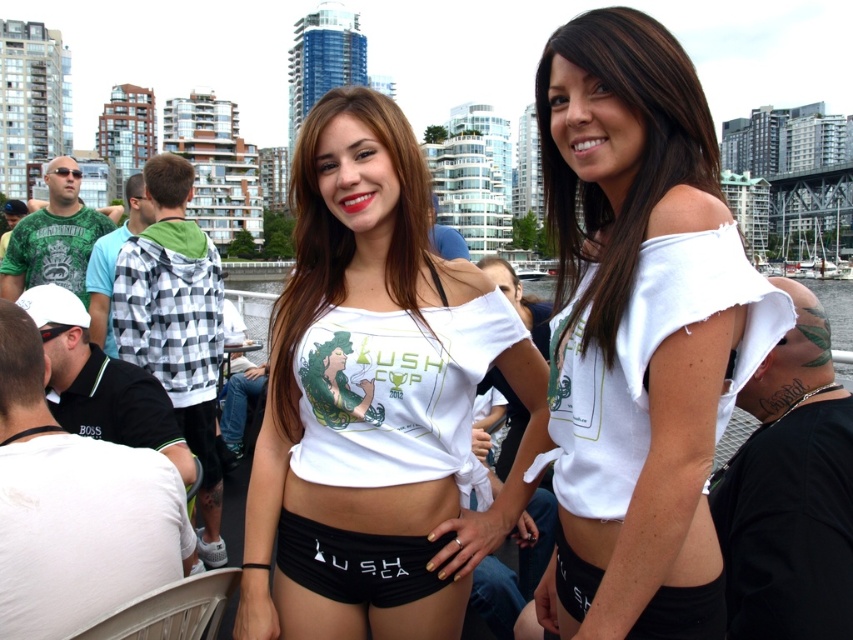
Question: Can you confirm if white matte bikini top at center is positioned above black matte shorts at center?

Choices:
 (A) no
 (B) yes

Answer: (B)

Question: Does white matte crop top at center come in front of white matte bikini top at center?

Choices:
 (A) yes
 (B) no

Answer: (A)

Question: Is white frayed shirt at center smaller than black matte shorts at center?

Choices:
 (A) yes
 (B) no

Answer: (B)

Question: Which object is the closest to the white frayed shirt at center?

Choices:
 (A) black matte shorts at center
 (B) white matte crop top at center

Answer: (B)

Question: Among these points, which one is farthest from the camera?

Choices:
 (A) (409, 346)
 (B) (433, 548)
 (C) (329, 236)

Answer: (C)

Question: Which of the following is the farthest from the observer?

Choices:
 (A) (410, 436)
 (B) (317, 371)

Answer: (B)